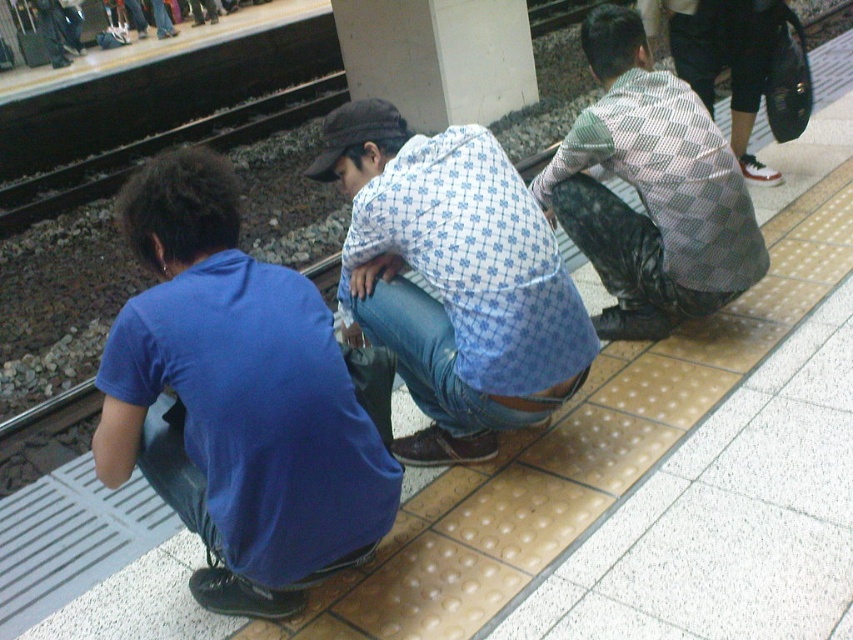
Can you confirm if blue cotton shirt at lower left is shorter than blue printed shirt at center?

In fact, blue cotton shirt at lower left may be taller than blue printed shirt at center.

In the scene shown: Can you confirm if blue cotton shirt at lower left is positioned to the right of blue printed shirt at center?

Incorrect, blue cotton shirt at lower left is not on the right side of blue printed shirt at center.

Who is more distant from viewer, [242,518] or [426,220]?

Positioned behind is point [426,220].

Locate an element on the screen. This screenshot has width=853, height=640. blue cotton shirt at lower left is located at coordinates (241, 400).

Can you confirm if blue cotton shirt at lower left is thinner than checkered fabric shirt at center?

Correct, blue cotton shirt at lower left's width is less than checkered fabric shirt at center's.

Between blue cotton shirt at lower left and checkered fabric shirt at center, which one has more height?

checkered fabric shirt at center is taller.

Locate an element on the screen. This screenshot has height=640, width=853. blue cotton shirt at lower left is located at coordinates (241, 400).

Does blue printed shirt at center have a lesser width compared to checkered fabric shirt at center?

In fact, blue printed shirt at center might be wider than checkered fabric shirt at center.

This screenshot has width=853, height=640. What do you see at coordinates (453, 278) in the screenshot?
I see `blue printed shirt at center` at bounding box center [453, 278].

The width and height of the screenshot is (853, 640). In order to click on blue printed shirt at center in this screenshot , I will do `click(453, 278)`.